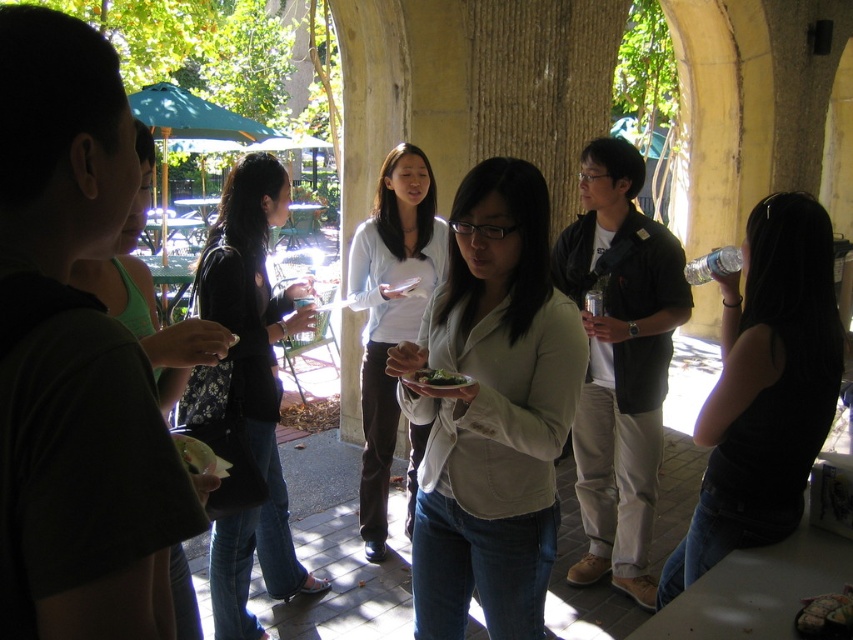
You are at the point labeled point (106, 285) and want to move to the point labeled point (799, 365). Is the path between them clear of any obstacles?

The point labeled point (799, 365) is behind the point labeled point (106, 285), so there might be an obstacle blocking the path between them.

You are organizing a clothing display and need to arrange the white matte shirt at center and the matte black shirt at left on a rack. Based on their sizes, which shirt should be placed on the left side of the rack to ensure proper visibility?

The white matte shirt at center is thinner than the matte black shirt at left, so placing the thinner white matte shirt at center on the left side of the rack will ensure it stands out and remains visible next to the thicker matte black shirt at left.